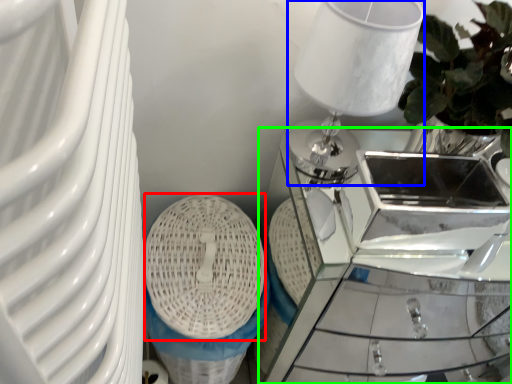
Question: Considering the real-world distances, which object is farthest from basket (highlighted by a red box)? table lamp (highlighted by a blue box) or table (highlighted by a green box)?

Choices:
 (A) table lamp
 (B) table

Answer: (B)